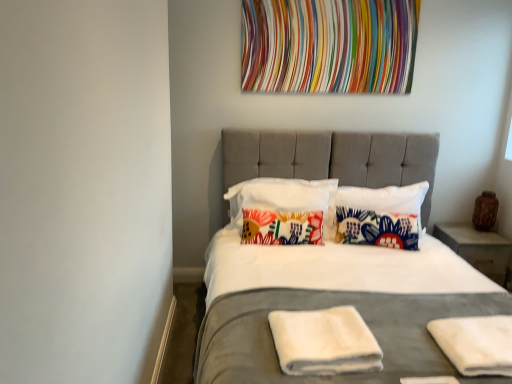
Question: From the image's perspective, is multicolored fabric at upper center above or below floral fabric pillow at center, the 2th pillow from the right?

Choices:
 (A) above
 (B) below

Answer: (A)

Question: Visually, is multicolored fabric at upper center positioned to the left or to the right of floral fabric pillow at center, which is the third pillow in left-to-right order?

Choices:
 (A) right
 (B) left

Answer: (B)

Question: Considering the real-world distances, which object is farthest from the white cotton pillow at center, the 2th pillow when ordered from left to right?

Choices:
 (A) white towel at center, which is counted as the 1th material, starting from the left
 (B) matte gray bed at center
 (C) floral fabric pillow at center, marked as the fourth pillow in a left-to-right arrangement
 (D) floral fabric pillow at center, the 1th pillow positioned from the left
 (E) multicolored fabric at upper center

Answer: (A)

Question: Which object is the closest to the multicolored fabric at upper center?

Choices:
 (A) matte gray bed at center
 (B) concrete/rough nightstand at right
 (C) floral fabric pillow at center, marked as the fourth pillow in a left-to-right arrangement
 (D) white cotton pillow at center, the 2th pillow when ordered from left to right
 (E) floral fabric pillow at center, which appears as the 4th pillow when viewed from the right

Answer: (D)